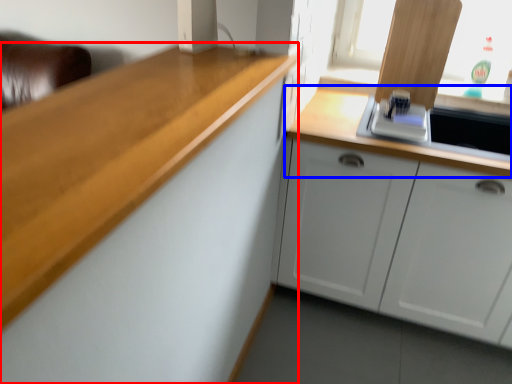
Question: Which object appears farthest to the camera in this image, cabinetry (highlighted by a red box) or countertop (highlighted by a blue box)?

Choices:
 (A) cabinetry
 (B) countertop

Answer: (B)